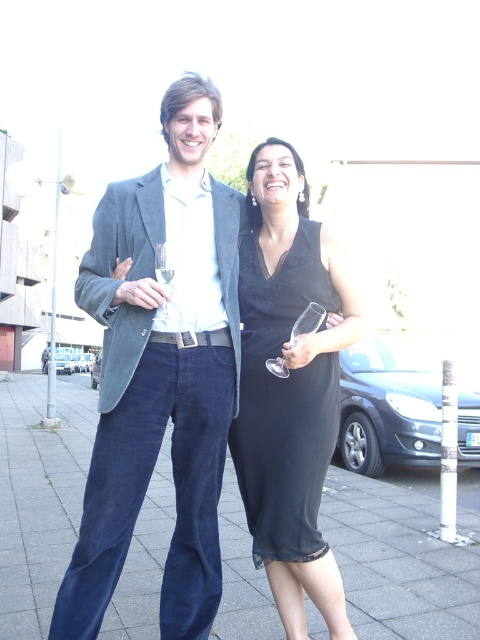
You are standing at point (x=164, y=314) and want to walk to point (x=108, y=284). Which direction should you move?

You should move forward because point (x=108, y=284) is in front of point (x=164, y=314).

You are standing at the point labeled point (399,561) in the image. What is the material of the surface you are standing on?

The surface at point (399,561) is dark blue concrete pavement.